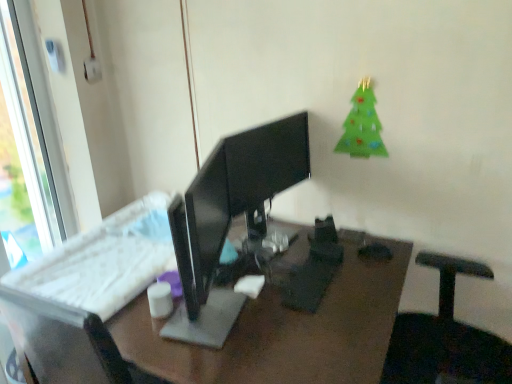
The width and height of the screenshot is (512, 384). Find the location of `vacant space positioned to the left of white matte cup at center`. vacant space positioned to the left of white matte cup at center is located at coordinates (117, 309).